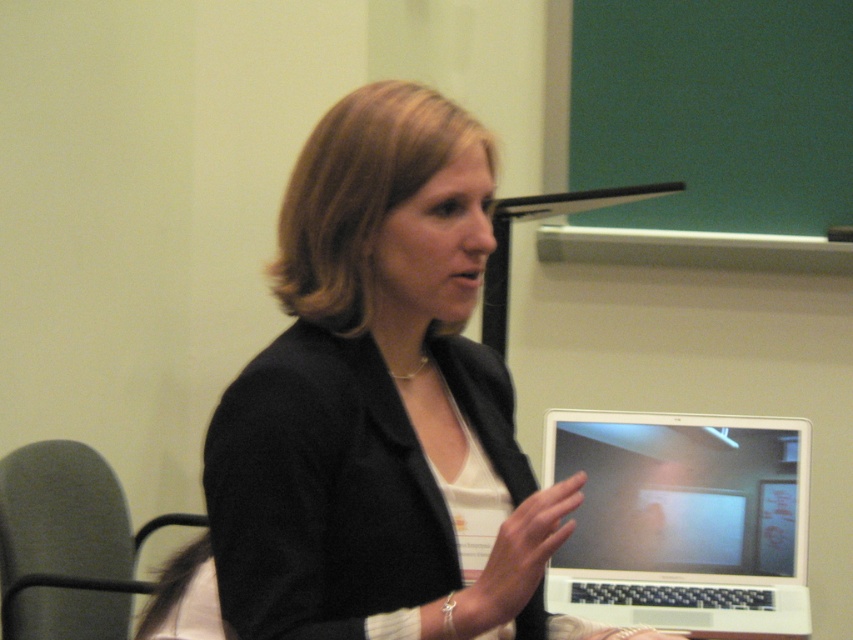
You are a person who is 5 feet tall. You want to sit in the dark gray fabric chair at left and reach the white glossy laptop at lower right to retrieve a USB drive from it. Can you comfortably do this without moving the chair or the laptop?

The distance between the white glossy laptop at lower right and dark gray fabric chair at left is 3.55 feet. A person who is 5 feet tall can comfortably reach across this distance to retrieve the USB drive without needing to move either object.